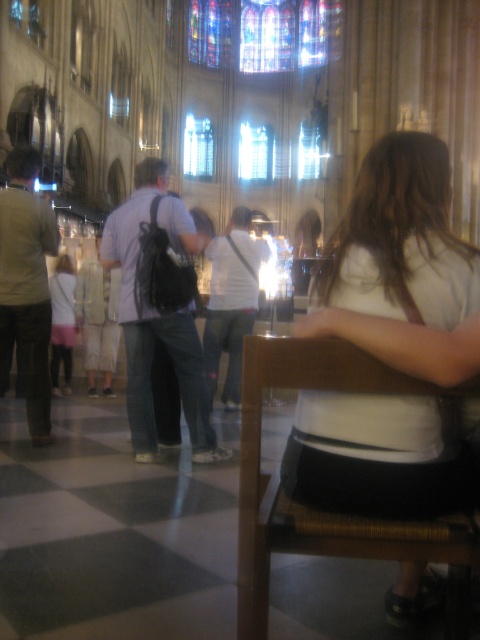
Question: Does brown woven chair at center have a larger size compared to clear glass window at center?

Choices:
 (A) yes
 (B) no

Answer: (B)

Question: Does white cotton shirt at lower left appear on the left side of clear glass window at center?

Choices:
 (A) no
 (B) yes

Answer: (B)

Question: Does white cotton shirt at lower left appear on the left side of clear glass window at center?

Choices:
 (A) no
 (B) yes

Answer: (B)

Question: Which of the following is the closest to the observer?

Choices:
 (A) white cotton shirt at lower left
 (B) brown woven chair at center
 (C) clear glass window at center

Answer: (B)

Question: Which point is farther from the camera taking this photo?

Choices:
 (A) (213, 140)
 (B) (368, 388)
 (C) (70, 348)

Answer: (A)

Question: Which point is farther to the camera?

Choices:
 (A) (328, 376)
 (B) (67, 316)

Answer: (B)